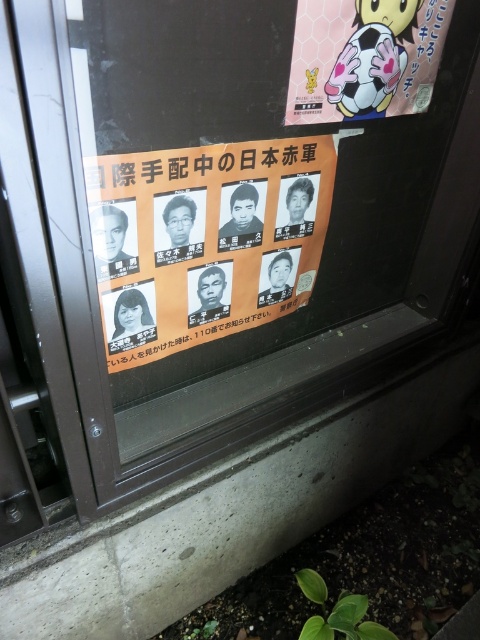
Consider the image. You are a delivery person who needs to hang a new poster on the wall. There is already an orange paper poster at center and a matte pink soccer ball at upper right on the wall. Where should you place your new poster so it doesn not overlap with the existing ones?

Place the new poster to the left of the orange paper poster at center or to the right of the matte pink soccer ball at upper right to avoid overlapping, since the orange paper poster at center is positioned on the left side of the matte pink soccer ball at upper right.

You are a delivery person who needs to hang a new notice on the wall. The notice you have is the same size as the matte pink soccer ball at upper right. Is there enough space next to the orange paper poster at center to place your notice without overlapping?

The orange paper poster at center has a larger size compared to the matte pink soccer ball at upper right. Since your notice is the same size as the matte pink soccer ball at upper right, there should be enough space next to the orange paper poster at center to place your notice without overlapping.

From the picture: You are standing 1 meter away from the window. There is a point marked at coordinates point (85, 177) on the window. Can you reach that point with your hand?

The distance of point (85, 177) from viewer is 88.54 centimeters. Since you are standing 1 meter away, which is 100 centimeters, the point is closer to you than your current position. Therefore, you can reach it with your hand.